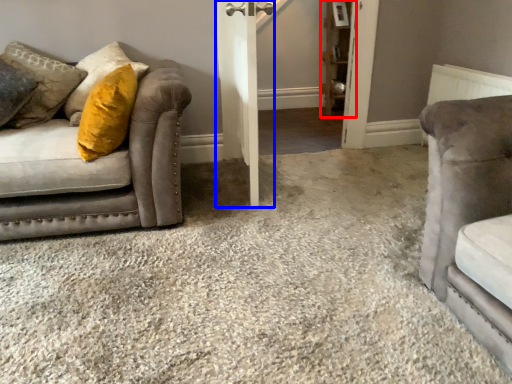
Question: Which point is closer to the camera, shelf (highlighted by a red box) or barn door (highlighted by a blue box)?

Choices:
 (A) shelf
 (B) barn door

Answer: (B)